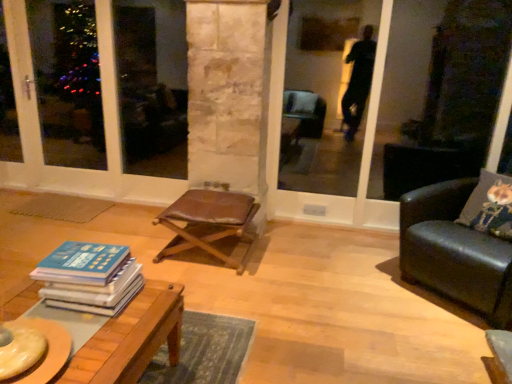
At what (x,y) coordinates should I click in order to perform the action: click on vacant region in front of blue hardcover book at lower left. Please return your answer as a coordinate pair (x, y). This screenshot has height=384, width=512. Looking at the image, I should click on (92, 337).